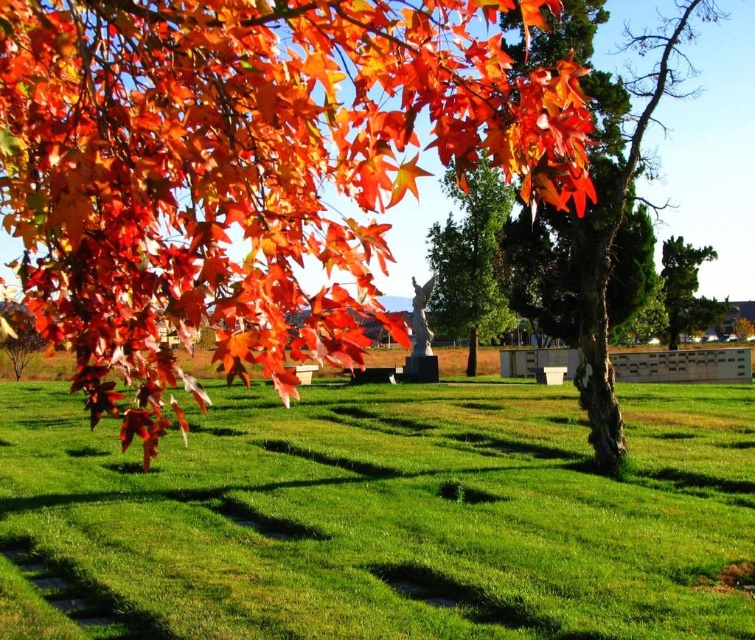
You are planning to set up a picnic blanket in the park. You want to choose a spot where there is more space for the blanket. Based on the scene, which area should you choose between the green grass at center and the brown rough bark tree at center?

The brown rough bark tree at center occupies more space than the green grass at center, so you should choose the area around the brown rough bark tree at center for more space.

You are a photographer trying to capture a shot of the smooth green tree at center without any distractions. However, there are shiny orange leaves at upper left in the scene. Based on their positions, will the leaves block your view of the tree?

A: The shiny orange leaves at upper left are in front of the smooth green tree at center, so they will block the view of the tree.